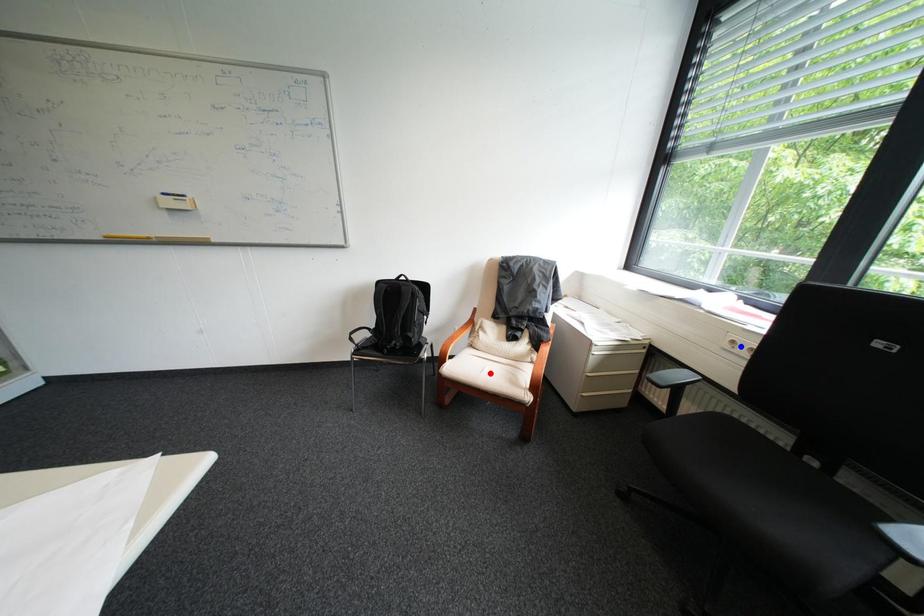
Question: Which of the two points in the image is closer to the camera?

Choices:
 (A) Blue point is closer.
 (B) Red point is closer.

Answer: (A)